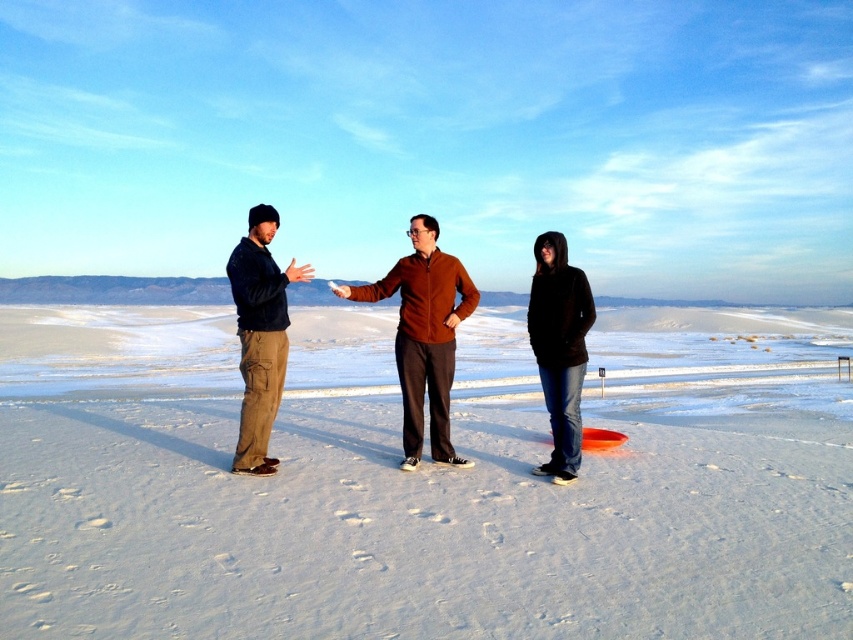
Question: Does brown fleece jacket at center appear under black matte hoodie at lower right?

Choices:
 (A) yes
 (B) no

Answer: (B)

Question: Considering the real-world distances, which object is closest to the white sandy beach at center?

Choices:
 (A) black matte hoodie at lower right
 (B) matte black jacket at left
 (C) brown fleece jacket at center

Answer: (B)

Question: Observing the image, what is the correct spatial positioning of white sandy beach at center in reference to brown fleece jacket at center?

Choices:
 (A) left
 (B) right

Answer: (A)

Question: Among these points, which one is farthest from the camera?

Choices:
 (A) (572, 332)
 (B) (262, 390)
 (C) (354, 484)
 (D) (410, 346)

Answer: (D)

Question: Which point is farther to the camera?

Choices:
 (A) white sandy beach at center
 (B) black matte hoodie at lower right
 (C) matte black jacket at left
 (D) brown fleece jacket at center

Answer: (D)

Question: Is white sandy beach at center positioned in front of matte black jacket at left?

Choices:
 (A) yes
 (B) no

Answer: (A)